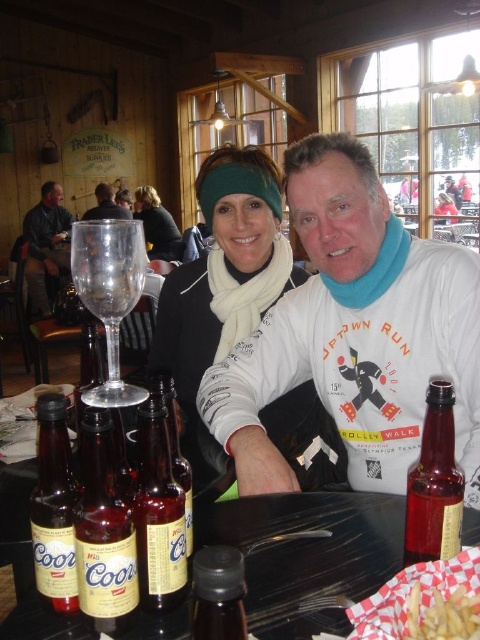
Question: Which is farther from the matte black hair at upper center?

Choices:
 (A) white cotton turtleneck at center
 (B) matte plastic bottles at center
 (C) matte glass beer bottle at center

Answer: (C)

Question: Can you confirm if matte glass beer bottle at center is smaller than dark brown leather jacket at upper center?

Choices:
 (A) yes
 (B) no

Answer: (A)

Question: Based on their relative distances, which object is farther from the matte black jacket at upper center?

Choices:
 (A) matte black hair at upper center
 (B) dark brown leather jacket at upper center
 (C) translucent glass beer bottle at center
 (D) translucent glass bottle at lower right

Answer: (D)

Question: Among these points, which one is farthest from the camera?

Choices:
 (A) (427, 336)
 (B) (139, 227)
 (C) (107, 452)

Answer: (A)

Question: Is matte white scarf at center positioned at the back of translucent glass bottle at center?

Choices:
 (A) yes
 (B) no

Answer: (A)

Question: Does amber glass beer bottle at center appear under translucent glass bottle at center?

Choices:
 (A) no
 (B) yes

Answer: (A)